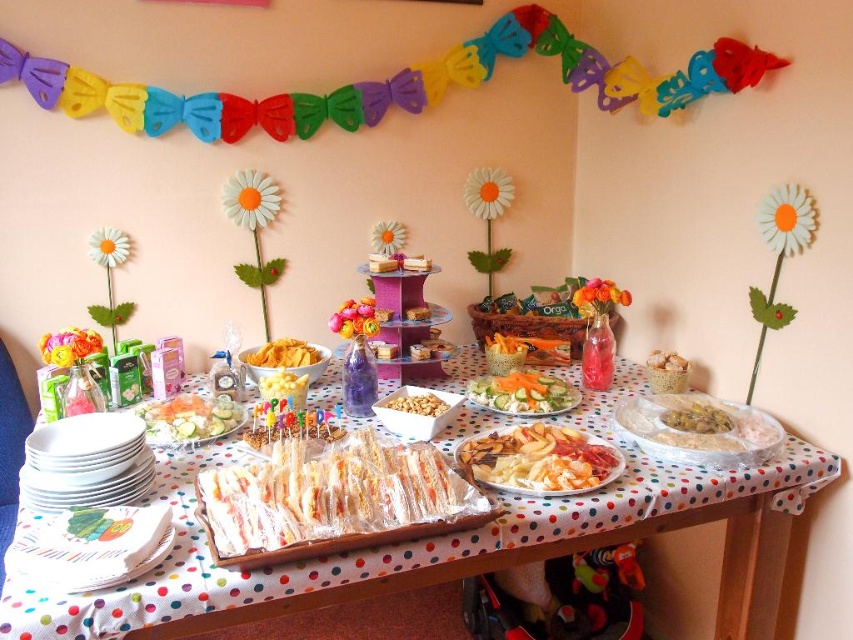
Which is in front, point (311, 358) or point (675, 371)?

Point (675, 371) is in front.

The height and width of the screenshot is (640, 853). In order to click on yellow crispy chips at center in this screenshot , I will do `click(283, 355)`.

What do you see at coordinates (283, 355) in the screenshot? Image resolution: width=853 pixels, height=640 pixels. I see `yellow crispy chips at center` at bounding box center [283, 355].

Where is `yellow crispy chips at center`? yellow crispy chips at center is located at coordinates (283, 355).

Who is more distant from viewer, (491, 390) or (718, 413)?

Point (491, 390)

Find the location of a particular element. The width and height of the screenshot is (853, 640). white creamy salad at center is located at coordinates (521, 392).

The height and width of the screenshot is (640, 853). In order to click on white creamy salad at center in this screenshot , I will do `click(521, 392)`.

Who is shorter, translucent plastic sandwiches at center or white creamy salad at center?

white creamy salad at center is shorter.

Does translucent plastic sandwiches at center have a greater height compared to white creamy salad at center?

Indeed, translucent plastic sandwiches at center has a greater height compared to white creamy salad at center.

Who is more forward, [409,451] or [469,397]?

Positioned in front is point [409,451].

The image size is (853, 640). In order to click on translucent plastic sandwiches at center in this screenshot , I will do `click(328, 493)`.